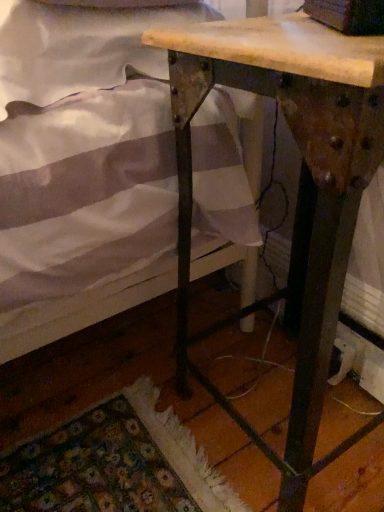
The height and width of the screenshot is (512, 384). I want to click on free space below wooden table at center (from a real-world perspective), so click(x=284, y=400).